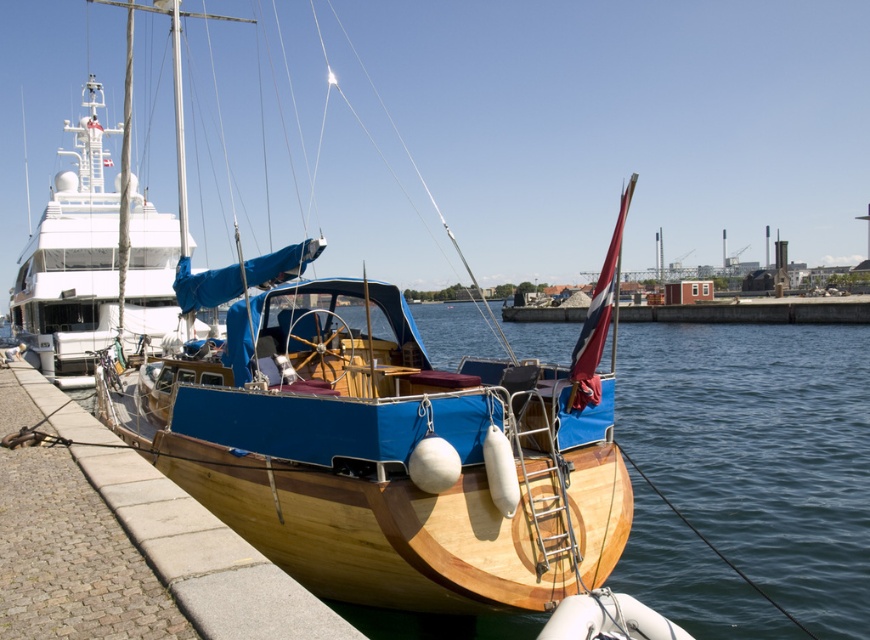
You are standing on the brown wooden dock at lower left and want to board the wooden sailboat at center. In which direction should you move relative to the dock to reach the sailboat?

The wooden sailboat at center is to the left of the brown wooden dock at lower left, so you should move to the left relative to the dock to reach the sailboat.

You are standing at the edge of the pier and want to take a photo of the two points marked in the image. Which point, point [191,244] or point [152,467], will appear larger in your camera view?

Point [191,244] will appear larger in the camera view because it is closer to the camera compared to point [152,467].